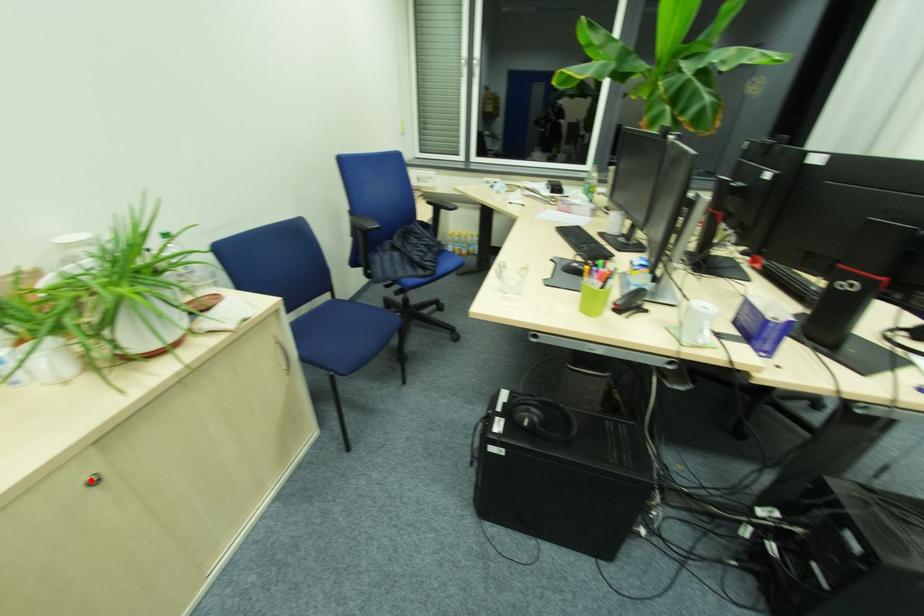
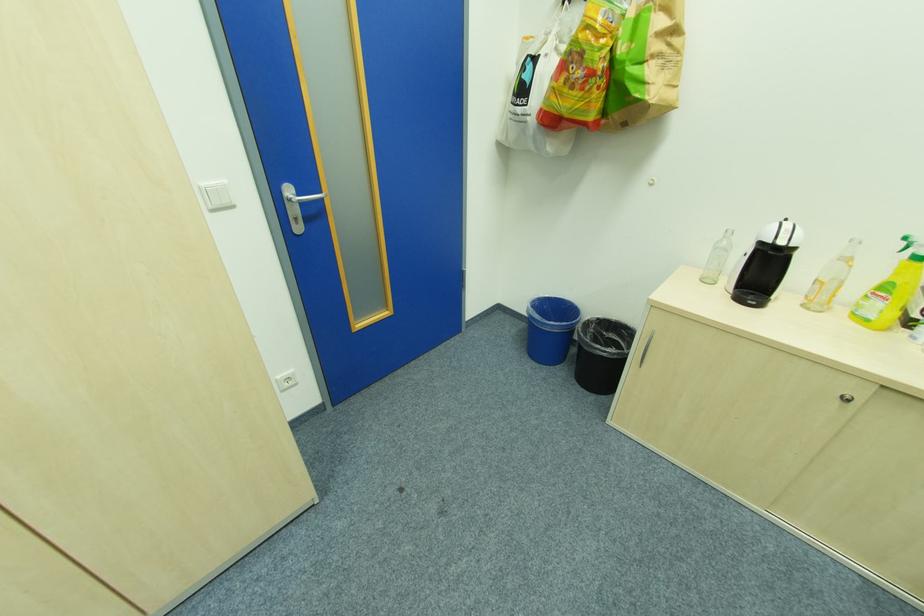
Where in the second image is the point corresponding to the highlighted location from the first image?

(852, 395)